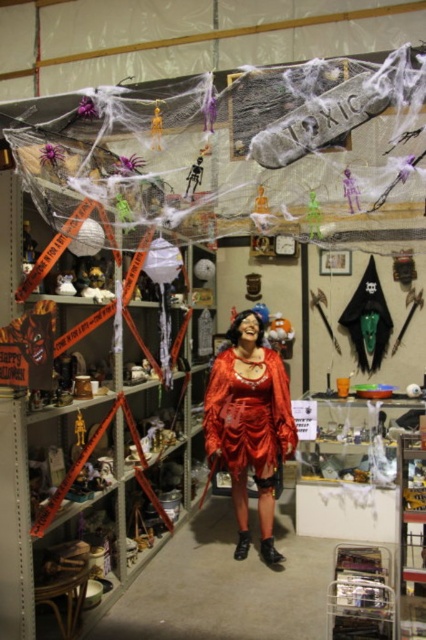
Is shiny red dress at center further to the viewer compared to green plastic plant at center?

Yes, shiny red dress at center is behind green plastic plant at center.

Between shiny red dress at center and green plastic plant at center, which one has less height?

Standing shorter between the two is green plastic plant at center.

Locate an element on the screen. This screenshot has width=426, height=640. shiny red dress at center is located at coordinates (249, 424).

Is orange paper banner at left above clear plastic shelf at center?

Yes.

Which is more to the right, orange paper banner at left or clear plastic shelf at center?

From the viewer's perspective, clear plastic shelf at center appears more on the right side.

Does point (86, 531) lie behind point (370, 616)?

Yes.

Find the location of a particular element. The image size is (426, 640). orange paper banner at left is located at coordinates (100, 476).

Between shiny red dress at center and clear plastic shelf at center, which one has less height?

With less height is clear plastic shelf at center.

Is point (241, 477) positioned in front of point (374, 554)?

No, (241, 477) is further to viewer.

Find the location of a particular element. This screenshot has width=426, height=640. shiny red dress at center is located at coordinates 249,424.

You are a GUI agent. You are given a task and a screenshot of the screen. Output one action in this format:
    pyautogui.click(x=<x>, y=<y>)
    Task: Click on the shiny red dress at center
    This screenshot has width=426, height=640.
    Given the screenshot: What is the action you would take?
    pyautogui.click(x=249, y=424)